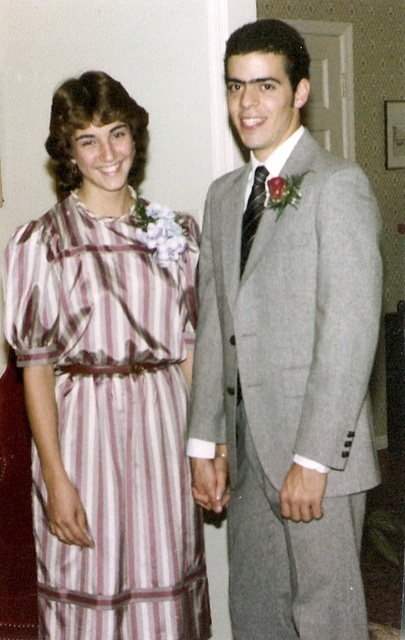
You are a photographer setting up for a group photo. You have two outfits in the scene, the gray wool suit at center and the striped silk dress at left. Based on their sizes, which outfit would require more space to accommodate comfortably in the frame?

The gray wool suit at center has a larger size compared to the striped silk dress at left, so it would require more space to accommodate comfortably in the frame.